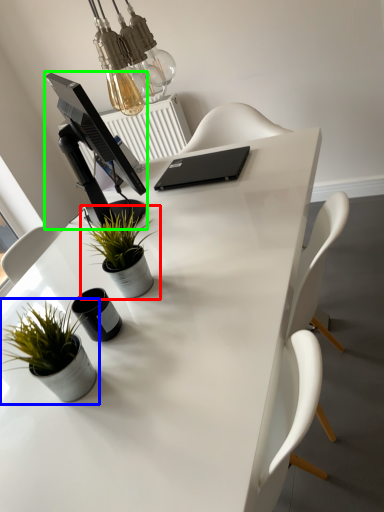
Question: Estimate the real-world distances between objects in this image. Which object is closer to houseplant (highlighted by a red box), houseplant (highlighted by a blue box) or computer monitor (highlighted by a green box)?

Choices:
 (A) houseplant
 (B) computer monitor

Answer: (B)